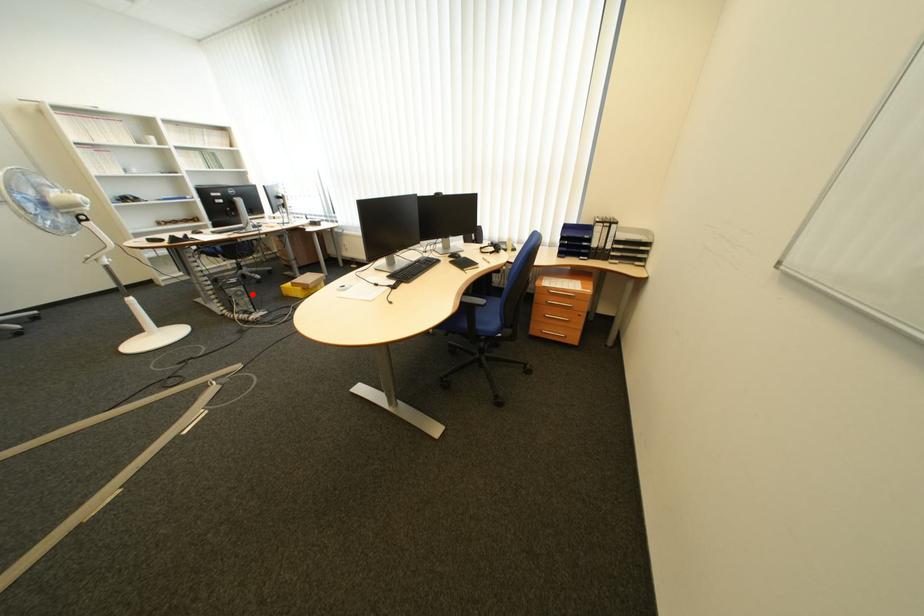
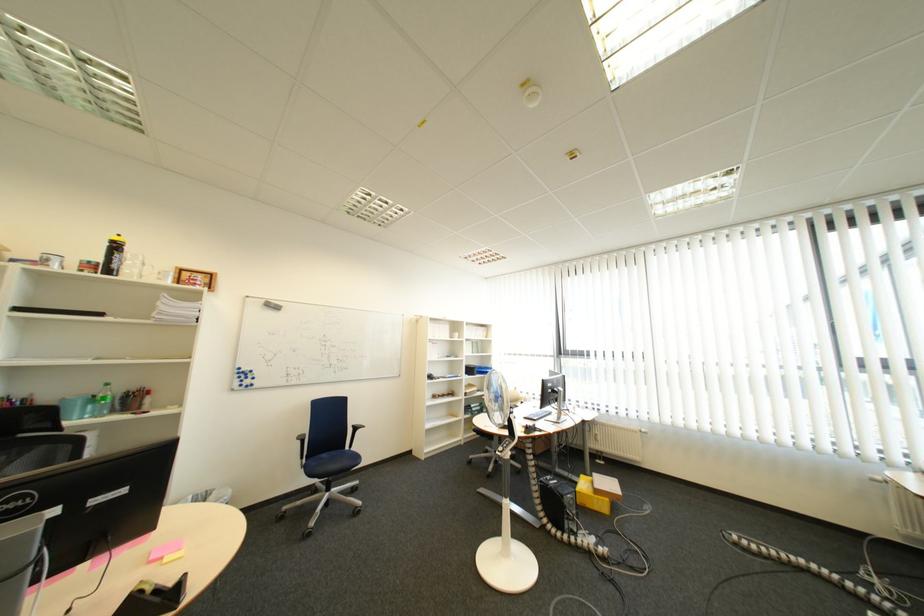
In the second image, find the point that corresponds to the highlighted location in the first image.

(585, 503)